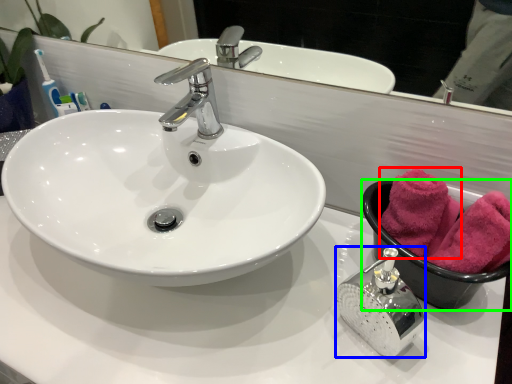
Question: Estimate the real-world distances between objects in this image. Which object is closer to bath towel (highlighted by a red box), soap dispenser (highlighted by a blue box) or basin (highlighted by a green box)?

Choices:
 (A) soap dispenser
 (B) basin

Answer: (B)